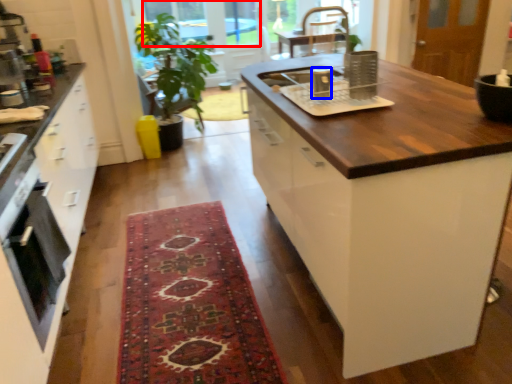
Question: Among these objects, which one is nearest to the camera, window screen (highlighted by a red box) or appliance (highlighted by a blue box)?

Choices:
 (A) window screen
 (B) appliance

Answer: (B)